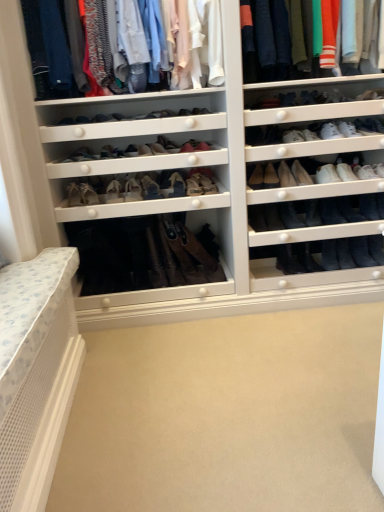
This screenshot has width=384, height=512. Describe the element at coordinates (330, 255) in the screenshot. I see `black suede shoe at lower right, positioned as the seventeenth shoe in left-to-right order` at that location.

You are a GUI agent. You are given a task and a screenshot of the screen. Output one action in this format:
    pyautogui.click(x=<x>, y=<y>)
    Task: Click on the black suede shoe at lower center, which is counted as the 9th shoe, starting from the right
    
    Given the screenshot: What is the action you would take?
    pyautogui.click(x=288, y=260)

Considering the relative sizes of matte beige shoe at center-left, acting as the 2th shoe starting from the left, and white leather shoe at center, the 11th shoe positioned from the left, in the image provided, is matte beige shoe at center-left, acting as the 2th shoe starting from the left, bigger than white leather shoe at center, the 11th shoe positioned from the left,?

Yes.

From a real-world perspective, between matte beige shoe at center-left, acting as the 2th shoe starting from the left, and white leather shoe at center, the eleventh shoe in the right-to-left sequence, who is vertically higher?

white leather shoe at center, the eleventh shoe in the right-to-left sequence.

Does matte beige shoe at center-left, acting as the 2th shoe starting from the left, have a lesser height compared to white leather shoe at center, the 11th shoe positioned from the left?

No.

Find the location of a particular element. Image resolution: width=384 pixels, height=512 pixels. the 10th shoe below when counting from the white leather shoe at center, the 11th shoe positioned from the left (from the image's perspective) is located at coordinates [x=88, y=194].

Is there a large distance between black suede shoe at lower center, which is counted as the 9th shoe, starting from the right, and matte beige shoe at center-left, acting as the 2th shoe starting from the left?

black suede shoe at lower center, which is counted as the 9th shoe, starting from the right, is far away from matte beige shoe at center-left, acting as the 2th shoe starting from the left.

Which of these two, black suede shoe at lower center, which ranks as the thirteenth shoe in left-to-right order, or matte beige shoe at center-left, acting as the 2th shoe starting from the left, is wider?

black suede shoe at lower center, which ranks as the thirteenth shoe in left-to-right order.

Identify the location of the 11th shoe to the left when counting from the black suede shoe at lower center, which ranks as the thirteenth shoe in left-to-right order. (88, 194).

From the image's perspective, which one is positioned lower, black suede shoe at lower center, which is counted as the 9th shoe, starting from the right, or matte beige shoe at center-left, acting as the 2th shoe starting from the left?

black suede shoe at lower center, which is counted as the 9th shoe, starting from the right.

At what (x,y) coordinates should I click in order to perform the action: click on the 8th shoe in front of the black leather boot at center, the 8th shoe in the right-to-left sequence, counting from the anchor's position. Please return your answer as a coordinate pair (x, y). Looking at the image, I should click on (176, 185).

Can you confirm if matte beige shoe at center, marked as the 6th shoe in a left-to-right arrangement, is taller than black leather boot at center, the 8th shoe in the right-to-left sequence?

No, matte beige shoe at center, marked as the 6th shoe in a left-to-right arrangement, is not taller than black leather boot at center, the 8th shoe in the right-to-left sequence.

Considering the relative positions of matte beige shoe at center, marked as the 6th shoe in a left-to-right arrangement, and black leather boot at center, the 8th shoe in the right-to-left sequence, in the image provided, is matte beige shoe at center, marked as the 6th shoe in a left-to-right arrangement, to the left of black leather boot at center, the 8th shoe in the right-to-left sequence, from the viewer's perspective?

Yes, matte beige shoe at center, marked as the 6th shoe in a left-to-right arrangement, is to the left of black leather boot at center, the 8th shoe in the right-to-left sequence.

Between matte beige shoe at center, marked as the 6th shoe in a left-to-right arrangement, and black leather boot at center, the fourteenth shoe viewed from the left, which one is positioned in front?

matte beige shoe at center, marked as the 6th shoe in a left-to-right arrangement, is in front.

Find the location of a particular element. The height and width of the screenshot is (512, 384). the 8th shoe located above the matte white shoe at center, which appears as the eighteenth shoe when viewed from the right (from a real-world perspective) is located at coordinates (150, 188).

From a real-world perspective, does matte leather shoe at center, the 5th shoe viewed from the left, stand above matte white shoe at center, positioned as the fourth shoe in left-to-right order?

Correct, in the physical world, matte leather shoe at center, the 5th shoe viewed from the left, is higher than matte white shoe at center, positioned as the fourth shoe in left-to-right order.

Is matte leather shoe at center, placed as the 17th shoe when sorted from right to left, in front of or behind matte white shoe at center, positioned as the fourth shoe in left-to-right order, in the image?

matte leather shoe at center, placed as the 17th shoe when sorted from right to left, is in front of matte white shoe at center, positioned as the fourth shoe in left-to-right order.

Relative to matte beige shoe at center, which ranks as the sixteenth shoe in right-to-left order, is matte black shoe at center, the 13th shoe when ordered from right to left, in front or behind?

Visually, matte black shoe at center, the 13th shoe when ordered from right to left, is located behind matte beige shoe at center, which ranks as the sixteenth shoe in right-to-left order.

Which is behind, point (253, 181) or point (177, 193)?

The point (177, 193) is behind.

From the picture: From a real-world perspective, which is physically below, matte black shoe at center, the 13th shoe when ordered from right to left, or matte beige shoe at center, marked as the 6th shoe in a left-to-right arrangement?

In real-world perspective, matte black shoe at center, the 13th shoe when ordered from right to left, is lower.

At what (x,y) coordinates should I click in order to perform the action: click on shoe that is the 3rd object to the left of the matte black shoe at center, arranged as the ninth shoe when viewed from the left, starting at the anchor. Please return your answer as a coordinate pair (x, y). Image resolution: width=384 pixels, height=512 pixels. Looking at the image, I should click on (176, 185).

From the picture: How far apart are black leather boot at center, the 8th shoe in the right-to-left sequence, and white leather sneaker at upper right, the 3th shoe when ordered from right to left?

black leather boot at center, the 8th shoe in the right-to-left sequence, and white leather sneaker at upper right, the 3th shoe when ordered from right to left, are 49.73 centimeters apart from each other.

Considering the sizes of black leather boot at center, the fourteenth shoe viewed from the left, and white leather sneaker at upper right, the 19th shoe from the left, in the image, is black leather boot at center, the fourteenth shoe viewed from the left, wider or thinner than white leather sneaker at upper right, the 19th shoe from the left,?

Clearly, black leather boot at center, the fourteenth shoe viewed from the left, has less width compared to white leather sneaker at upper right, the 19th shoe from the left.

Are black leather boot at center, the 8th shoe in the right-to-left sequence, and white leather sneaker at upper right, the 19th shoe from the left, beside each other?

No, black leather boot at center, the 8th shoe in the right-to-left sequence, is not touching white leather sneaker at upper right, the 19th shoe from the left.

Based on the photo, from the image's perspective, between black leather boot at center, the 8th shoe in the right-to-left sequence, and white leather sneaker at upper right, the 19th shoe from the left, who is located below?

black leather boot at center, the 8th shoe in the right-to-left sequence, appears lower in the image.

Looking at this image, between black leather boot at center-right, the 12th shoe in the left-to-right sequence, and white leather sneaker at upper right, the 19th shoe from the left, which one has smaller width?

Thinner between the two is black leather boot at center-right, the 12th shoe in the left-to-right sequence.

Which of these two, black leather boot at center-right, the 12th shoe in the left-to-right sequence, or white leather sneaker at upper right, the 19th shoe from the left, stands shorter?

Standing shorter between the two is white leather sneaker at upper right, the 19th shoe from the left.

Which object is more forward, black leather boot at center-right, which ranks as the 10th shoe in right-to-left order, or white leather sneaker at upper right, the 3th shoe when ordered from right to left?

white leather sneaker at upper right, the 3th shoe when ordered from right to left, is closer to the camera.

The width and height of the screenshot is (384, 512). In order to click on the 8th shoe positioned below the white leather shoe at center, the 11th shoe positioned from the left (from a real-world perspective) in this screenshot , I will do `click(88, 194)`.

Where is `shoe that is the 11th object to the right of the matte beige shoe at center-left, acting as the 2th shoe starting from the left, starting at the anchor`? shoe that is the 11th object to the right of the matte beige shoe at center-left, acting as the 2th shoe starting from the left, starting at the anchor is located at coordinates (288, 260).

Estimate the real-world distances between objects in this image. Which object is closer to white leather shoe at center, the 11th shoe positioned from the left, matte black shoe at center, the 13th shoe when ordered from right to left, or black leather boot at center-right, the 12th shoe in the left-to-right sequence?

Based on the image, matte black shoe at center, the 13th shoe when ordered from right to left, appears to be nearer to white leather shoe at center, the 11th shoe positioned from the left.

From the image, which object appears to be nearer to matte white shirts at upper center, black suede shoe at lower right, positioned as the seventeenth shoe in left-to-right order, or matte black shoe at center, arranged as the ninth shoe when viewed from the left?

matte black shoe at center, arranged as the ninth shoe when viewed from the left, is positioned closer to the anchor matte white shirts at upper center.

Estimate the real-world distances between objects in this image. Which object is closer to matte black shoe at center, the 13th shoe when ordered from right to left, black leather boot at lower right, marked as the 21th shoe in a left-to-right arrangement, or matte white shirts at upper center?

The object closer to matte black shoe at center, the 13th shoe when ordered from right to left, is black leather boot at lower right, marked as the 21th shoe in a left-to-right arrangement.

Based on their spatial positions, is matte beige shoe at center, the nineteenth shoe in the right-to-left sequence, or matte beige shoe at center, marked as the 6th shoe in a left-to-right arrangement, closer to white leather sneaker at upper right, the 3th shoe when ordered from right to left?

matte beige shoe at center, marked as the 6th shoe in a left-to-right arrangement, is positioned closer to the anchor white leather sneaker at upper right, the 3th shoe when ordered from right to left.

Estimate the real-world distances between objects in this image. Which object is further from white leather sneaker at upper right, the 3th shoe when ordered from right to left, white leather shoe at upper right, arranged as the second shoe when viewed from the right, or white leather shoe at center, the eleventh shoe in the right-to-left sequence?

white leather shoe at center, the eleventh shoe in the right-to-left sequence, is further to white leather sneaker at upper right, the 3th shoe when ordered from right to left.

From the image, which object appears to be nearer to white leather sneaker at upper right, which is the 16th shoe in left-to-right order, matte beige shoe at center, marked as the third shoe in a left-to-right arrangement, or matte beige shoe at center, placed as the 15th shoe when sorted from right to left?

matte beige shoe at center, placed as the 15th shoe when sorted from right to left.

Considering their positions, is matte black shoe at center, arranged as the ninth shoe when viewed from the left, positioned further to leather tan boot at center, the 14th shoe in the right-to-left sequence, than white leather shoe at center, the eleventh shoe in the right-to-left sequence?

Among the two, white leather shoe at center, the eleventh shoe in the right-to-left sequence, is located further to leather tan boot at center, the 14th shoe in the right-to-left sequence.

Considering their positions, is matte beige shoe at center, placed as the 15th shoe when sorted from right to left, positioned closer to black leather boot at center-right, the 12th shoe in the left-to-right sequence, than white leather shoe at center, the eleventh shoe in the right-to-left sequence?

white leather shoe at center, the eleventh shoe in the right-to-left sequence, is positioned closer to the anchor black leather boot at center-right, the 12th shoe in the left-to-right sequence.

Find the location of a particular element. clothing situated between matte beige shoe at center, marked as the third shoe in a left-to-right arrangement, and matte beige shoe at center-right, the 10th shoe from the left, from left to right is located at coordinates (55, 47).

Locate an element on the screen. This screenshot has width=384, height=512. clothing between matte beige shoe at center, marked as the 21th shoe in a right-to-left arrangement, and black leather boot at center, the 8th shoe in the right-to-left sequence, from left to right is located at coordinates (55, 47).

The width and height of the screenshot is (384, 512). I want to click on clothing situated between matte beige shoe at center, the nineteenth shoe in the right-to-left sequence, and white leather shoe at center, the eleventh shoe in the right-to-left sequence, from left to right, so coord(55,47).

Where is `clothing between matte beige shoe at center-left, the twentieth shoe viewed from the right, and white leather sneaker at upper right, which is counted as the 6th shoe, starting from the right`? Image resolution: width=384 pixels, height=512 pixels. clothing between matte beige shoe at center-left, the twentieth shoe viewed from the right, and white leather sneaker at upper right, which is counted as the 6th shoe, starting from the right is located at coordinates (55, 47).